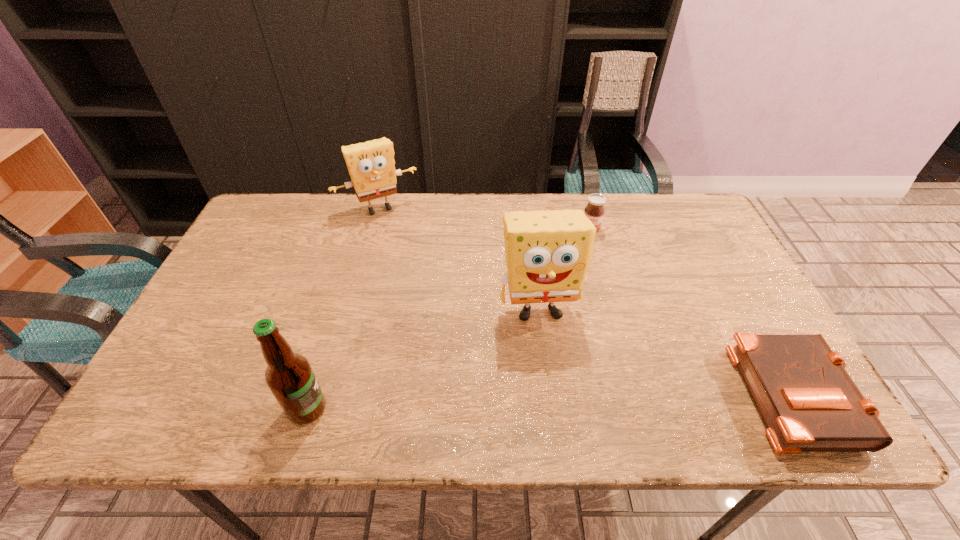
Identify the location of vacant space on the desktop that is between the beer bottle and the shortest object and is positioned on the face of the third nearest object. The width and height of the screenshot is (960, 540). [559, 400].

Find the location of `vacant space on the desktop that is between the beer bottle and the Bible and is positioned on the face of the farther sponge`. vacant space on the desktop that is between the beer bottle and the Bible and is positioned on the face of the farther sponge is located at coordinates (485, 403).

Find the location of `vacant spot on the desktop that is between the beer bottle and the shortest object and is positioned on the label side of the jam`. vacant spot on the desktop that is between the beer bottle and the shortest object and is positioned on the label side of the jam is located at coordinates (594, 399).